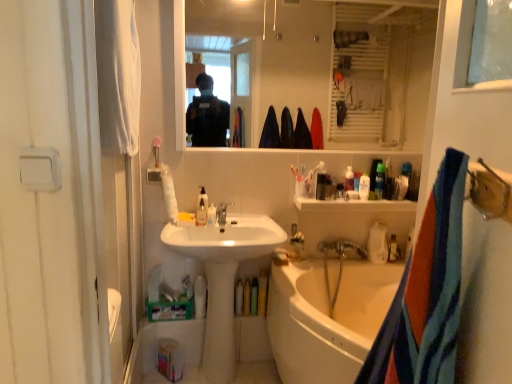
Question: Is clear glass mirror at upper center wider or thinner than translucent plastic soap dispenser at center, the 1th toiletry when ordered from left to right?

Choices:
 (A) wide
 (B) thin

Answer: (B)

Question: Is clear glass mirror at upper center taller or shorter than translucent plastic soap dispenser at center, the 1th toiletry when ordered from left to right?

Choices:
 (A) tall
 (B) short

Answer: (A)

Question: Which object is positioned closest to the white glossy sink at center?

Choices:
 (A) translucent plastic bottles at upper right, which appears as the fifth toiletry when viewed from the left
 (B) white fabric screen door at left
 (C) green cardboard box at lower center
 (D) clear glass mirror at upper center
 (E) translucent plastic soap dispenser at center, which is the 5th toiletry from right to left

Answer: (E)

Question: Estimate the real-world distances between objects in this image. Which object is farther from the green cardboard box at lower center?

Choices:
 (A) white glossy faucet at center
 (B) translucent plastic cup at upper center, arranged as the second toiletry when viewed from the left
 (C) blue striped towel at right, which is the first towel/napkin from bottom to top
 (D) white fabric towel at left, arranged as the 2th towel/napkin when ordered from the bottom
 (E) white plastic bottle at upper center, arranged as the 2th toiletry when viewed from the right

Answer: (C)